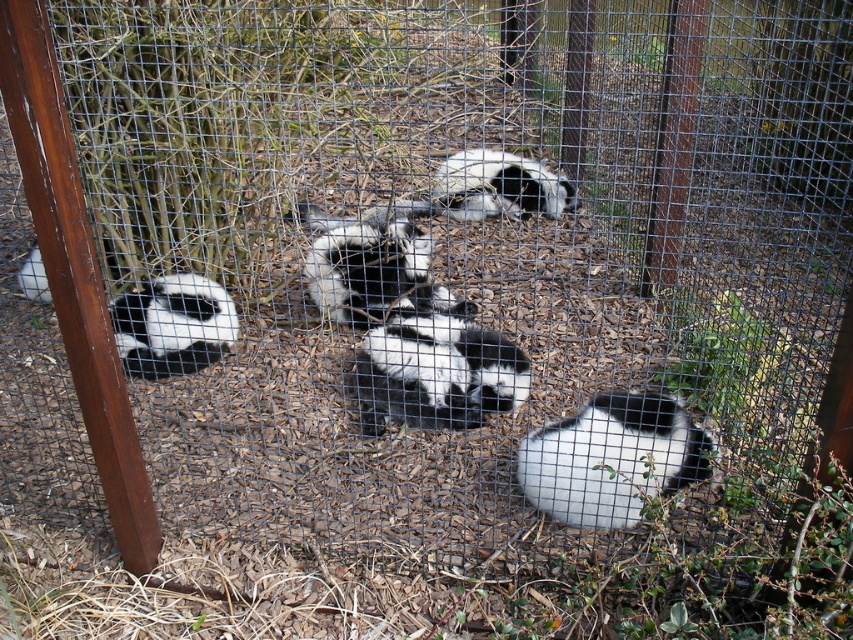
You are a zookeeper who needs to feed two animals in the enclosure. The first is the black and white fur panda at left, and the second is the black and white fur at center. If you start at the entrance near the fence, which animal should you approach first to minimize the distance walked?

You should approach the black and white fur panda at left first because it is closer to the entrance near the fence than the black and white fur at center, which is 1.60 meters away from it.

You are a zookeeper who needs to locate the black and white fur panda at left in the enclosure. According to the coordinates provided, where would you find it?

The black and white fur panda at left is located at coordinates point (172, 324).

You are a zookeeper who needs to separate two pandas for feeding. You see a soft fur panda at lower right and a black and white fur panda at left. Which panda is closer to the right side of the enclosure?

The soft fur panda at lower right is closer to the right side of the enclosure because it is positioned to the right of the black and white fur panda at left.